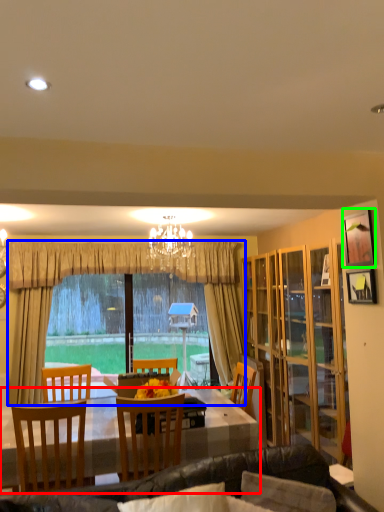
Question: Estimate the real-world distances between objects in this image. Which object is farther from desk (highlighted by a red box), curtain (highlighted by a blue box) or picture frame (highlighted by a green box)?

Choices:
 (A) curtain
 (B) picture frame

Answer: (A)